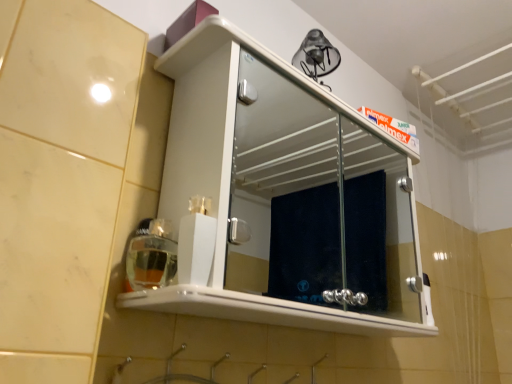
Question: Is white glossy cabinet at upper center inside translucent plastic soap dispenser at lower left?

Choices:
 (A) yes
 (B) no

Answer: (B)

Question: Is translucent plastic soap dispenser at lower left thinner than white glossy cabinet at upper center?

Choices:
 (A) no
 (B) yes

Answer: (B)

Question: Considering the relative sizes of translucent plastic soap dispenser at lower left and white glossy cabinet at upper center in the image provided, is translucent plastic soap dispenser at lower left bigger than white glossy cabinet at upper center?

Choices:
 (A) no
 (B) yes

Answer: (A)

Question: From the image's perspective, is translucent plastic soap dispenser at lower left above white glossy cabinet at upper center?

Choices:
 (A) yes
 (B) no

Answer: (B)

Question: Is translucent plastic soap dispenser at lower left wider than white glossy cabinet at upper center?

Choices:
 (A) yes
 (B) no

Answer: (B)

Question: Is translucent plastic soap dispenser at lower left completely or partially outside of white glossy cabinet at upper center?

Choices:
 (A) yes
 (B) no

Answer: (B)

Question: Could you tell me if white glossy cabinet at upper center is turned towards translucent plastic soap dispenser at lower left?

Choices:
 (A) yes
 (B) no

Answer: (B)

Question: From the image's perspective, does white glossy cabinet at upper center appear higher than translucent plastic soap dispenser at lower left?

Choices:
 (A) yes
 (B) no

Answer: (A)

Question: Is white glossy cabinet at upper center positioned far away from translucent plastic soap dispenser at lower left?

Choices:
 (A) no
 (B) yes

Answer: (B)

Question: Is white glossy cabinet at upper center closer to camera compared to translucent plastic soap dispenser at lower left?

Choices:
 (A) no
 (B) yes

Answer: (B)

Question: Can you confirm if white glossy cabinet at upper center is taller than translucent plastic soap dispenser at lower left?

Choices:
 (A) yes
 (B) no

Answer: (A)

Question: Is white glossy cabinet at upper center to the right of translucent plastic soap dispenser at lower left from the viewer's perspective?

Choices:
 (A) yes
 (B) no

Answer: (A)

Question: Relative to white glossy cabinet at upper center, is translucent plastic soap dispenser at lower left in front or behind?

Choices:
 (A) behind
 (B) front

Answer: (A)